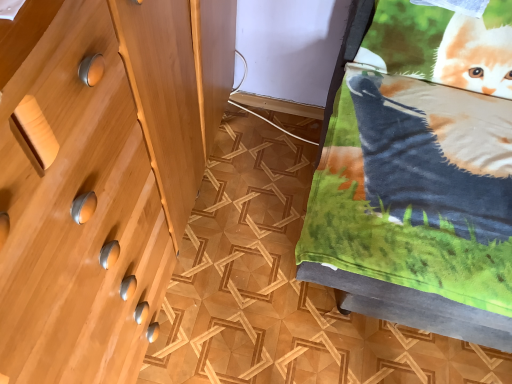
Where is `vacant region to the left of fluffy fleece blanket at upper right`? The image size is (512, 384). vacant region to the left of fluffy fleece blanket at upper right is located at coordinates (247, 249).